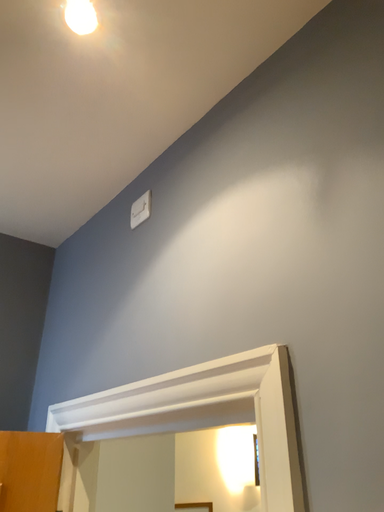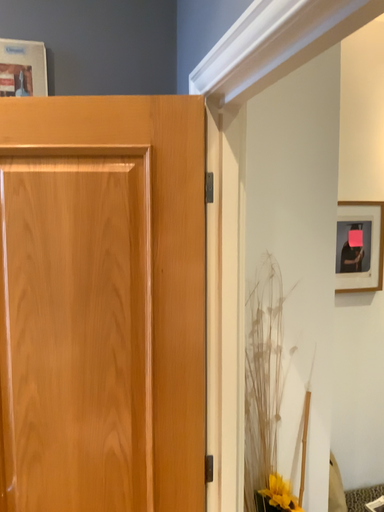
Question: Which way did the camera rotate in the video?

Choices:
 (A) rotated downward
 (B) rotated upward

Answer: (A)